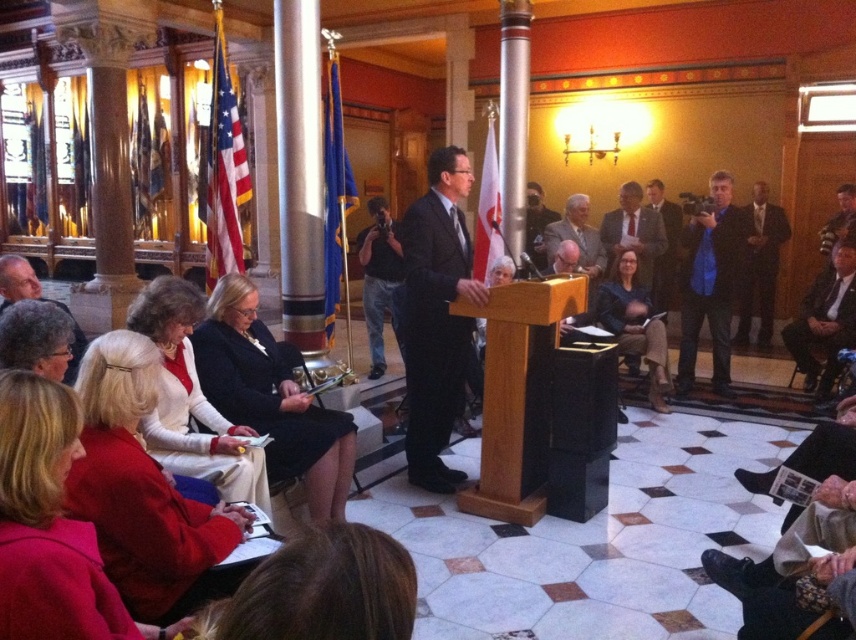
You are an event organizer who needs to ensure all attendees have enough space to move comfortably. The dark suit at center and the dark brown leather jacket at lower right are two attendees. Which attendee requires more space for their seating area?

The dark brown leather jacket at lower right requires more space for their seating area because its width is greater than the dark suit at center.